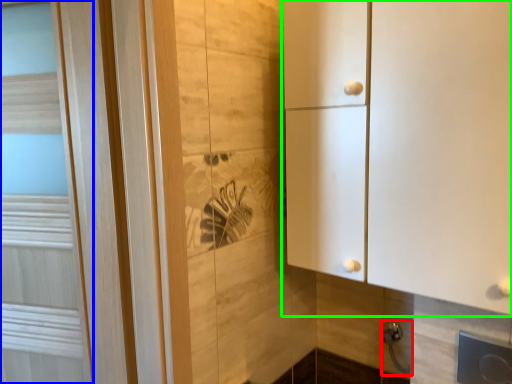
Question: Which is nearer to the door handle (highlighted by a red box)? door (highlighted by a blue box) or cupboard (highlighted by a green box).

Choices:
 (A) door
 (B) cupboard

Answer: (B)